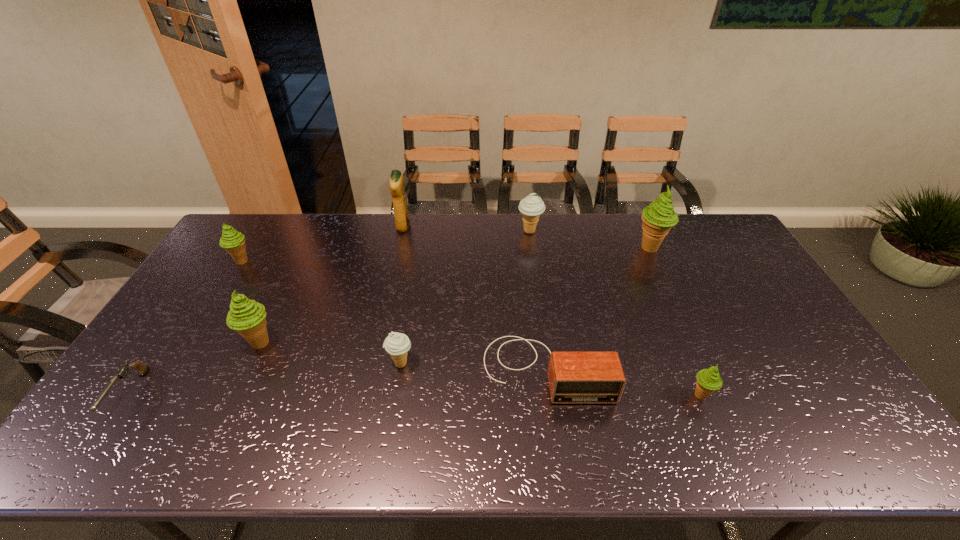
You are a GUI agent. You are given a task and a screenshot of the screen. Output one action in this format:
    pyautogui.click(x=<x>, y=<y>)
    Task: Click on the nearest icecream
    This screenshot has height=540, width=960.
    Given the screenshot: What is the action you would take?
    pos(708,380)

Locate an element on the screen. the nearest green icecream is located at coordinates (708, 380).

Locate an element on the screen. Image resolution: width=960 pixels, height=540 pixels. the second shortest object is located at coordinates (574, 377).

I want to click on the leftmost object, so click(141, 368).

Locate an element on the screen. the shortest object is located at coordinates (141, 368).

Locate an element on the screen. vacant space located 0.320m on the front of the biggest green icecream is located at coordinates (687, 328).

Find the location of a particular element. This screenshot has height=540, width=960. free space located on the label of the sixth object from right to left is located at coordinates (508, 227).

At what (x,y) coordinates should I click in order to perform the action: click on vacant space located 0.080m on the left of the fifth shortest icecream. Please return your answer as a coordinate pair (x, y). Image resolution: width=960 pixels, height=540 pixels. Looking at the image, I should click on (213, 343).

In order to click on vacant space located 0.070m on the front of the farther beige icecream in this screenshot , I will do pos(533,251).

I want to click on vacant space located on the front of the leftmost icecream, so click(179, 363).